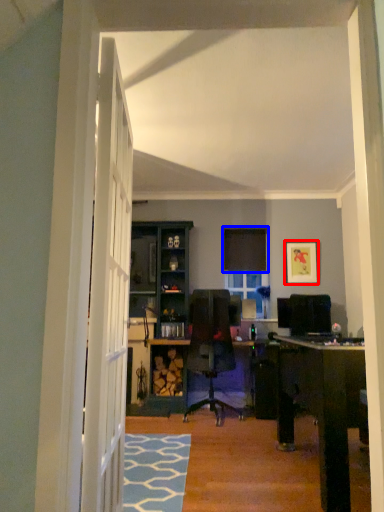
Question: Which object appears closest to the camera in this image, picture frame (highlighted by a red box) or curtain (highlighted by a blue box)?

Choices:
 (A) picture frame
 (B) curtain

Answer: (A)